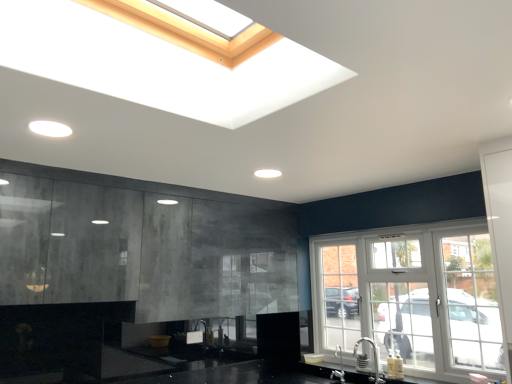
Question: Does matte concrete cabinets at left have a larger size compared to satin nickel faucet at lower center, the first faucet positioned from the front?

Choices:
 (A) yes
 (B) no

Answer: (A)

Question: Would you say matte concrete cabinets at left contains satin nickel faucet at lower center, the first faucet positioned from the front?

Choices:
 (A) no
 (B) yes

Answer: (A)

Question: Is matte concrete cabinets at left facing towards satin nickel faucet at lower center, the 2th faucet viewed from the left?

Choices:
 (A) yes
 (B) no

Answer: (B)

Question: Is matte concrete cabinets at left further to the viewer compared to satin nickel faucet at lower center, which is the first faucet from right to left?

Choices:
 (A) yes
 (B) no

Answer: (B)

Question: Is matte concrete cabinets at left not close to satin nickel faucet at lower center, which is the first faucet from right to left?

Choices:
 (A) yes
 (B) no

Answer: (A)

Question: Considering the positions of point (374, 359) and point (329, 279), is point (374, 359) closer or farther from the camera than point (329, 279)?

Choices:
 (A) closer
 (B) farther

Answer: (A)

Question: Considering the positions of satin nickel faucet at lower center, the 2th faucet viewed from the left, and white glass window at right in the image, is satin nickel faucet at lower center, the 2th faucet viewed from the left, wider or thinner than white glass window at right?

Choices:
 (A) thin
 (B) wide

Answer: (B)

Question: From a real-world perspective, relative to white glass window at right, is satin nickel faucet at lower center, which ranks as the second faucet in back-to-front order, vertically above or below?

Choices:
 (A) below
 (B) above

Answer: (A)

Question: Is satin nickel faucet at lower center, the first faucet positioned from the front, to the left or to the right of white glass window at right in the image?

Choices:
 (A) right
 (B) left

Answer: (B)

Question: Considering the positions of matte concrete cabinets at left and satin nickel faucet at lower center, which is the first faucet from right to left, in the image, is matte concrete cabinets at left taller or shorter than satin nickel faucet at lower center, which is the first faucet from right to left,?

Choices:
 (A) tall
 (B) short

Answer: (A)

Question: Is point (153, 256) positioned closer to the camera than point (370, 339)?

Choices:
 (A) closer
 (B) farther

Answer: (A)

Question: Would you say matte concrete cabinets at left is to the left or to the right of satin nickel faucet at lower center, which is the first faucet from right to left, in the picture?

Choices:
 (A) right
 (B) left

Answer: (B)

Question: Looking at the image, does matte concrete cabinets at left seem bigger or smaller compared to satin nickel faucet at lower center, which ranks as the second faucet in back-to-front order?

Choices:
 (A) big
 (B) small

Answer: (A)

Question: Considering the positions of matte concrete cabinets at left and white glass window at right in the image, is matte concrete cabinets at left bigger or smaller than white glass window at right?

Choices:
 (A) big
 (B) small

Answer: (A)

Question: In terms of height, does matte concrete cabinets at left look taller or shorter compared to white glass window at right?

Choices:
 (A) tall
 (B) short

Answer: (B)